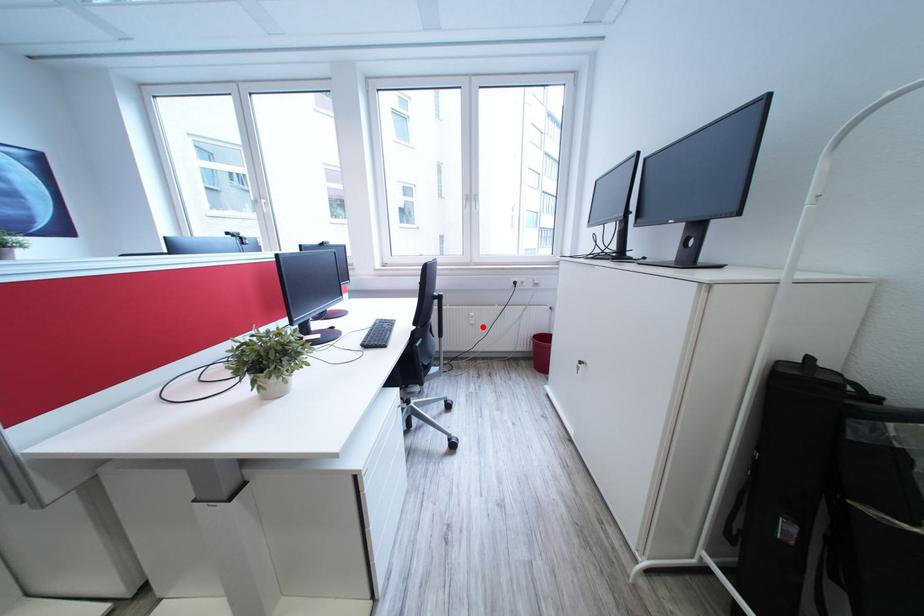
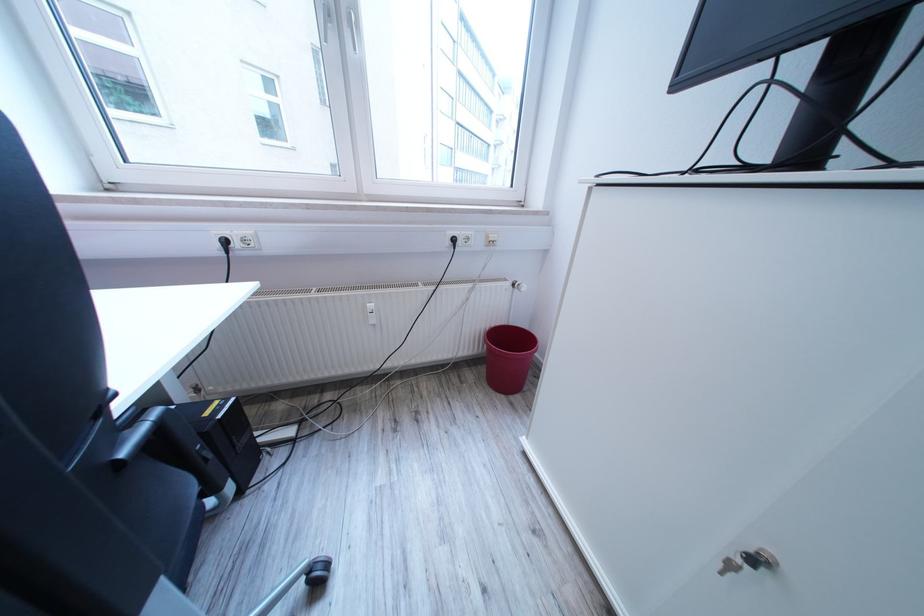
Locate, in the second image, the point that corresponds to the highlighted location in the first image.

(385, 326)